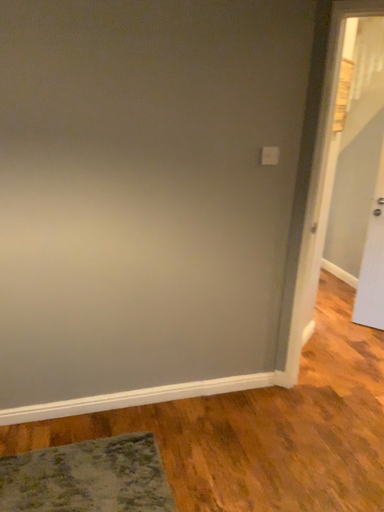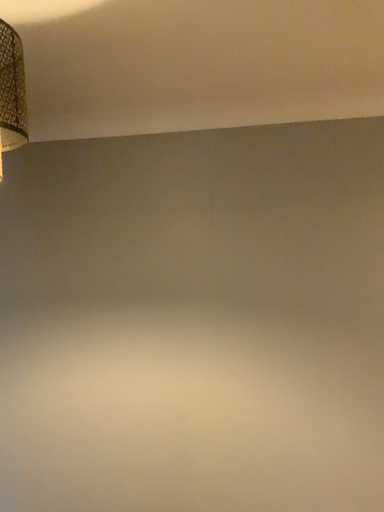
Question: Which way did the camera rotate in the video?

Choices:
 (A) rotated downward
 (B) rotated upward

Answer: (B)